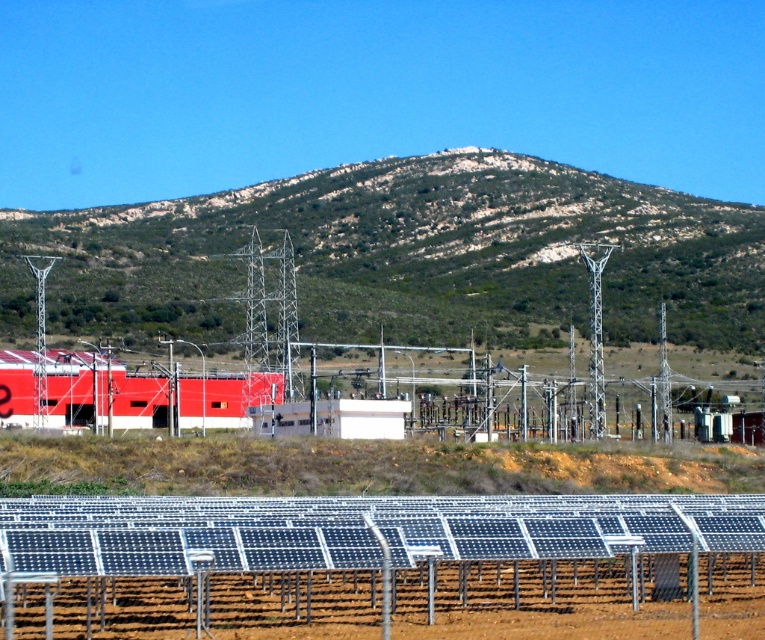
Question: Is green textured hill at center thinner than metallic silver fence at lower center?

Choices:
 (A) no
 (B) yes

Answer: (A)

Question: Does green textured hill at center appear on the right side of metallic silver fence at lower center?

Choices:
 (A) yes
 (B) no

Answer: (B)

Question: Which point is closer to the camera?

Choices:
 (A) green textured hill at center
 (B) metallic silver fence at lower center

Answer: (B)

Question: Is green textured hill at center further to camera compared to metallic silver fence at lower center?

Choices:
 (A) yes
 (B) no

Answer: (A)